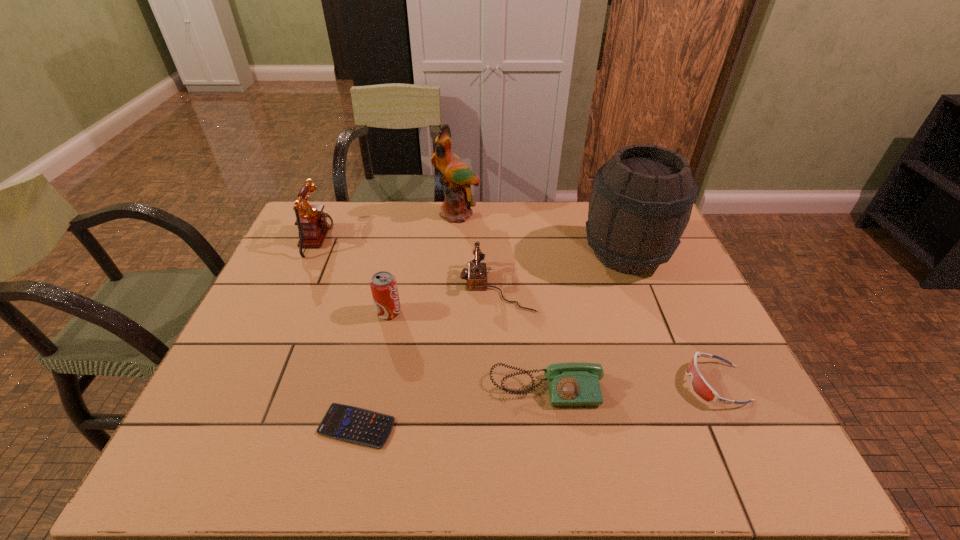
Where is `free space located 0.380m on the front-facing side of the goggles`? This screenshot has height=540, width=960. free space located 0.380m on the front-facing side of the goggles is located at coordinates (523, 383).

You are a GUI agent. You are given a task and a screenshot of the screen. Output one action in this format:
    pyautogui.click(x=<x>, y=<y>)
    Task: Click on the vacant space located 0.070m on the front-facing side of the goggles
    Image resolution: width=960 pixels, height=540 pixels.
    Given the screenshot: What is the action you would take?
    pyautogui.click(x=657, y=383)

Find the location of a particular element. Image resolution: width=960 pixels, height=540 pixels. vacant area situated on the back of the shortest object is located at coordinates (382, 313).

Image resolution: width=960 pixels, height=540 pixels. I want to click on parrot located at the far edge, so click(457, 177).

Find the location of `wine bucket that is at the far edge`. wine bucket that is at the far edge is located at coordinates (641, 203).

Locate an element on the screen. telephone present at the far edge is located at coordinates (313, 224).

Find the location of `object present at the near edge`. object present at the near edge is located at coordinates (348, 423).

The width and height of the screenshot is (960, 540). I want to click on object that is at the left edge, so click(313, 224).

Where is `wine bucket that is at the right edge`? This screenshot has width=960, height=540. wine bucket that is at the right edge is located at coordinates (641, 203).

At what (x,y) coordinates should I click in order to perform the action: click on goggles that is at the right edge. Please return your answer as a coordinate pair (x, y). The image size is (960, 540). Looking at the image, I should click on (700, 386).